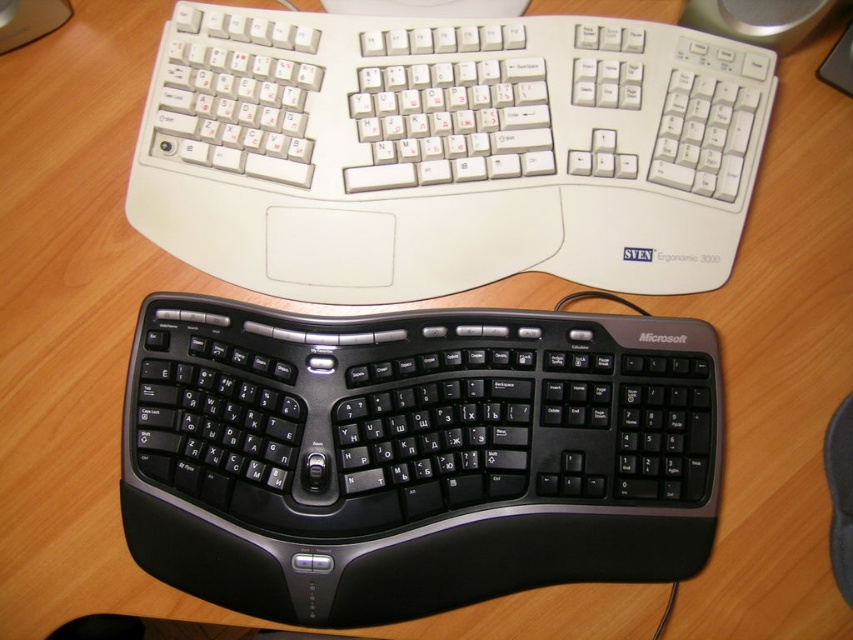
In the scene shown: You are a photographer setting up for a product shoot. You need to focus on the black plastic keyboard at center. The camera is currently positioned 25 inches away from the keyboard. Is the camera close enough to capture the keyboard in focus without moving closer?

The black plastic keyboard at center is 26.00 inches from the viewer. Since the camera is positioned at 25 inches away, it is closer than the required distance, meaning the camera is close enough to capture the keyboard in focus without moving closer.

You are organizing a workspace and need to move the black plastic keyboard at center and the white plastic keyboard at upper center. According to the image, which keyboard is positioned lower on the desk?

The black plastic keyboard at center is located below the white plastic keyboard at upper center, so the black plastic keyboard at center is positioned lower on the desk.

You are setting up a workstation and need to place both the black plastic keyboard at center and the white plastic keyboard at upper center on the desk. Given their sizes, which keyboard should you place first to ensure they fit properly?

The black plastic keyboard at center is shorter than the white plastic keyboard at upper center, so you should place the white plastic keyboard at upper center first to accommodate its larger size before positioning the smaller black plastic keyboard at center.